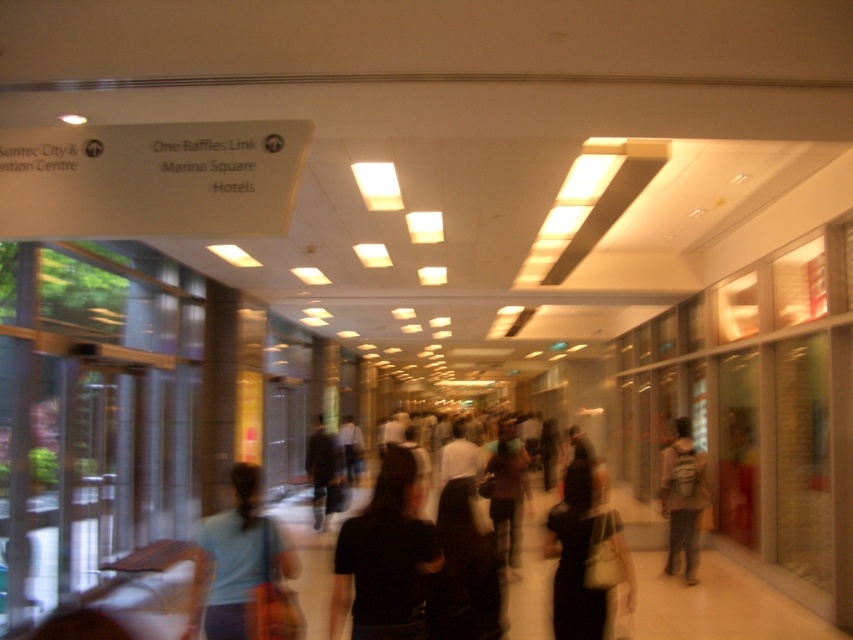
Question: Which point is farther to the camera?

Choices:
 (A) light blue fabric shirt at center
 (B) dark clothing at center

Answer: (B)

Question: Does light brown backpack at center lie in front of dark clothing at center?

Choices:
 (A) yes
 (B) no

Answer: (A)

Question: Is black matte shirt at center above black matte dress at center?

Choices:
 (A) no
 (B) yes

Answer: (B)

Question: Is black matte shirt at center to the right of light blue fabric shirt at center from the viewer's perspective?

Choices:
 (A) yes
 (B) no

Answer: (A)

Question: Which point is farther to the camera?

Choices:
 (A) (259, 518)
 (B) (694, 468)

Answer: (B)

Question: Which object is positioned closest to the black matte dress at center?

Choices:
 (A) dark clothing at center
 (B) light brown backpack at center
 (C) light blue fabric shirt at center
 (D) black matte shirt at center

Answer: (D)